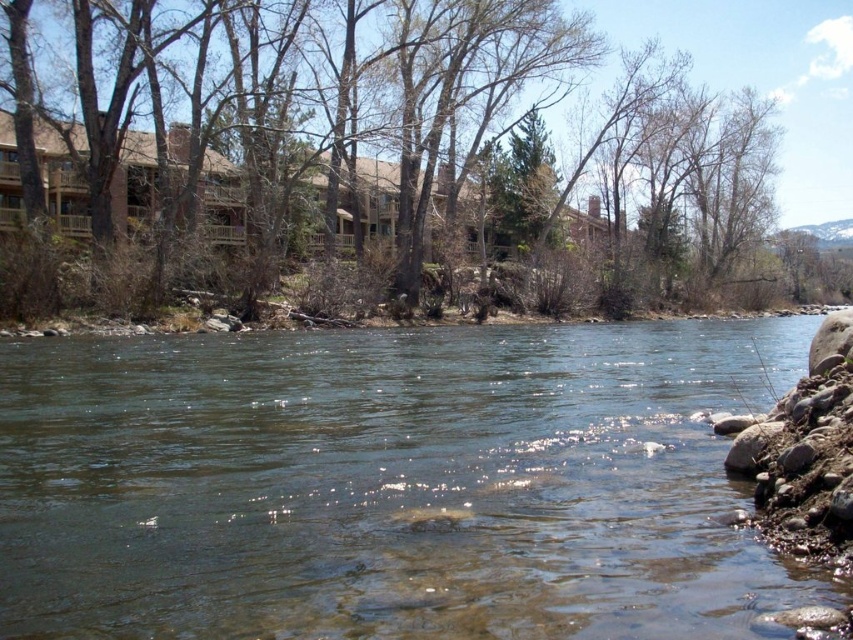
Looking at this image, you are a photographer planning to capture the riverside scene. You want to ensure that both the clear water at center and the brown wood tree at upper center are visible in your shot. Based on their sizes in the image, which object should you prioritize framing closer to the edge of the photo to avoid overcrowding?

The clear water at center occupies less space than the brown wood tree at upper center, so prioritize framing the brown wood tree at upper center closer to the edge to avoid overcrowding since it takes up more space in the image.

You are standing on the riverside and want to take a photo of both the clear water at center and the brown wood tree at upper center. Which object should you adjust your camera to focus on first if you want both to be in the frame?

You should focus on the clear water at center first because it is positioned on the left side of the brown wood tree at upper center, so adjusting focus starting from the left ensures both are captured.

You are standing at the origin point of the image coordinate system. Where is the clear water at center located in terms of coordinates?

The clear water at center is located at coordinates point [389,483].